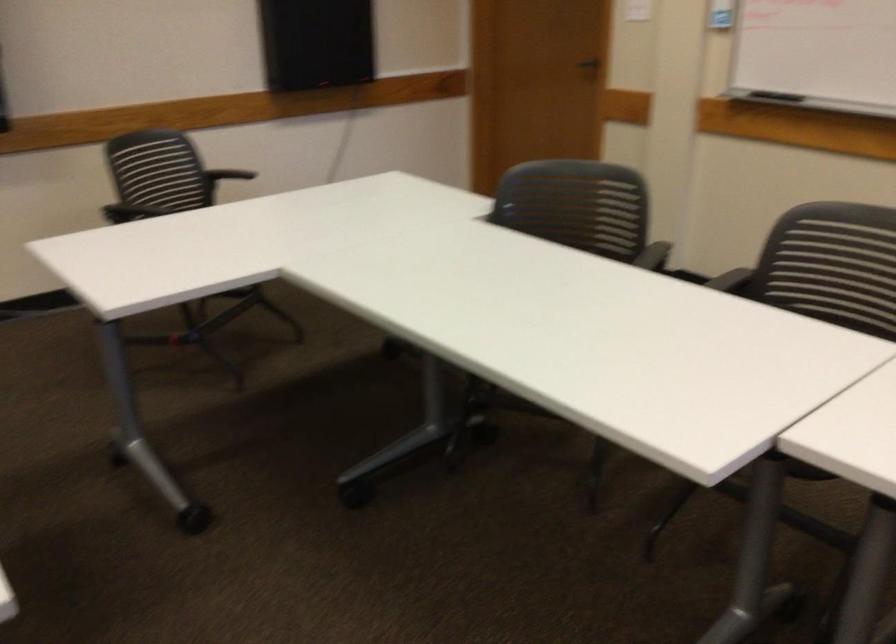
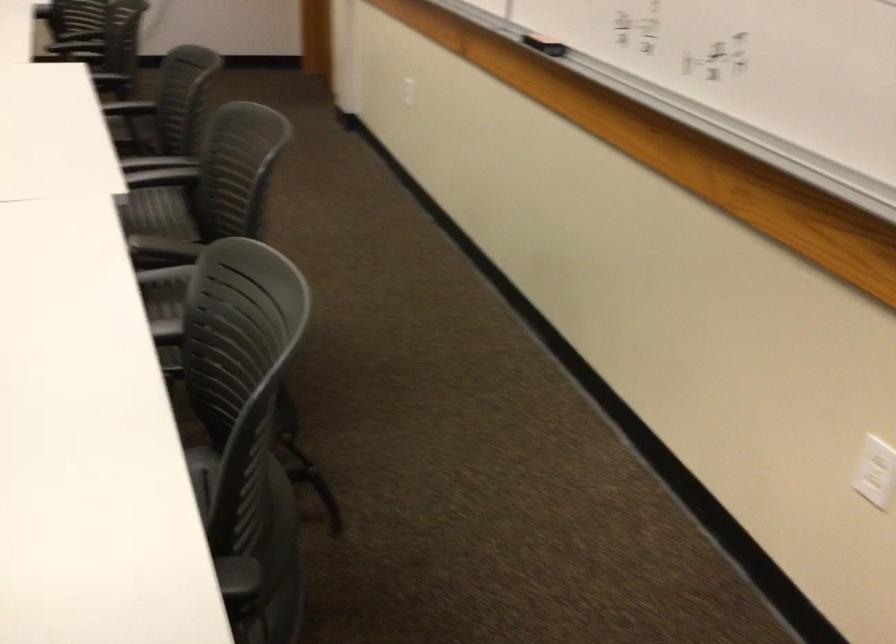
Question: What movement of the cameraman would produce the second image?

Choices:
 (A) Left
 (B) Right
 (C) Forward
 (D) Backward

Answer: (B)